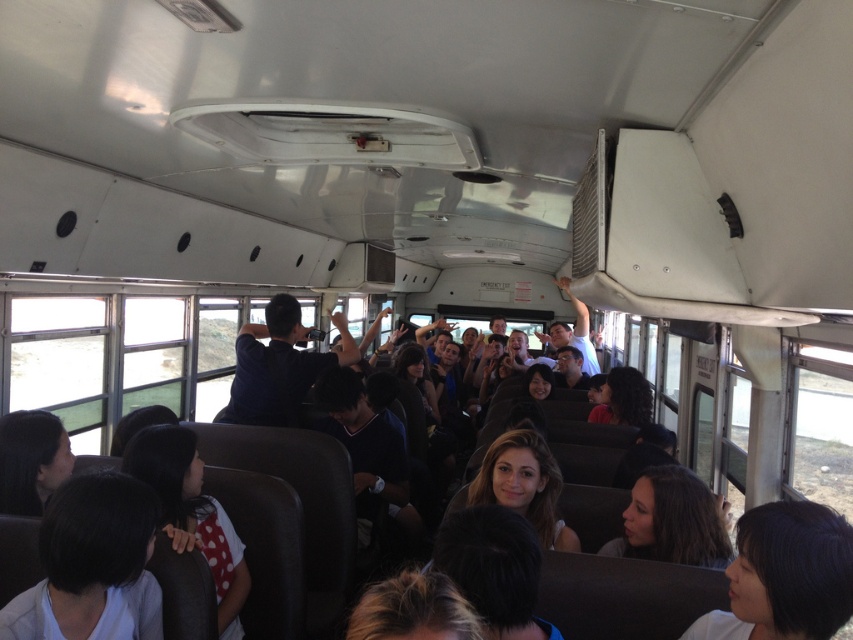
You are a passenger on a crowded school bus. You notice two people with dark hair at lower right and dark brown hair at center. Which person is closer to the front of the bus?

The dark hair at lower right is in front of dark brown hair at center, so the dark hair at lower right is closer to the front of the bus.

You are a passenger on a school bus and want to find a seat near the front. You notice a dark brown hair at lower left. Is the point at coordinate (91, 564) on the dark brown hair at lower left?

Yes, the point at coordinate (91, 564) is on the dark brown hair at lower left as stated in the description.

You are a passenger on a crowded school bus and need to reach the exit at the back. You are currently standing at point (838, 554). There is another passenger at point (85, 481). Which passenger is closer to the exit?

Point (85, 481) is behind point (838, 554), so the passenger at point (85, 481) is closer to the exit.